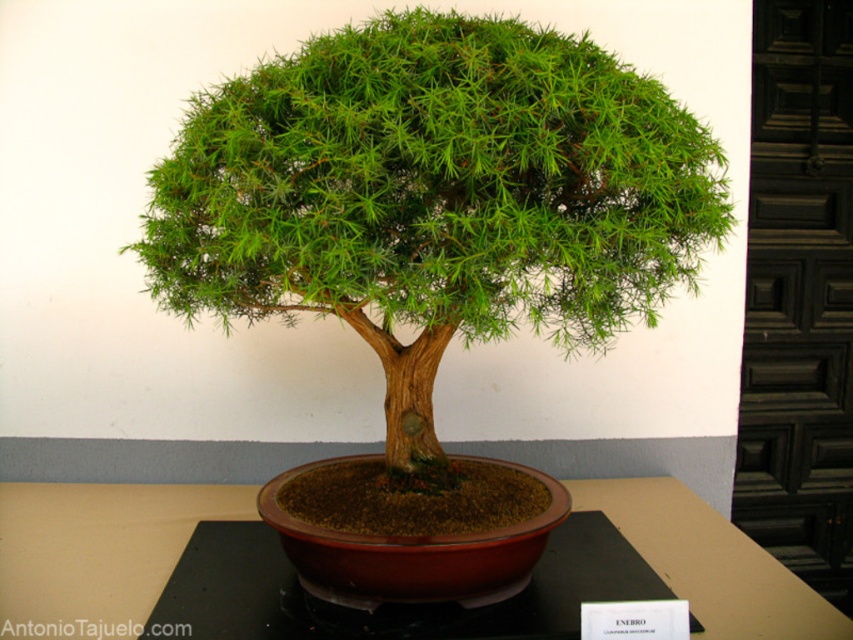
Measure the distance from green textured bonsai tree at center to brown wooden table at center.

green textured bonsai tree at center is 21.18 inches from brown wooden table at center.

Is point (463, 116) farther from camera compared to point (775, 593)?

No, (463, 116) is in front of (775, 593).

Where is `green textured bonsai tree at center`? The image size is (853, 640). green textured bonsai tree at center is located at coordinates (434, 196).